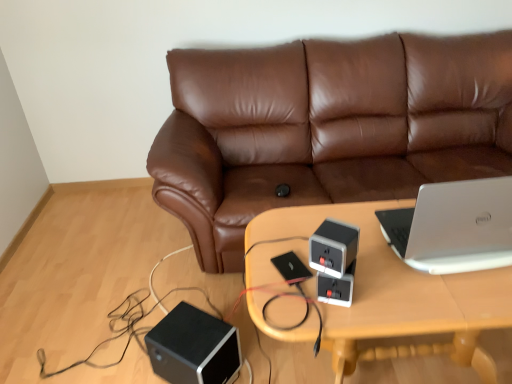
The height and width of the screenshot is (384, 512). What are the coordinates of `free space above black matte speaker at lower left, which ranks as the first speaker in bottom-to-top order (from a real-world perspective)` in the screenshot? It's located at (190, 329).